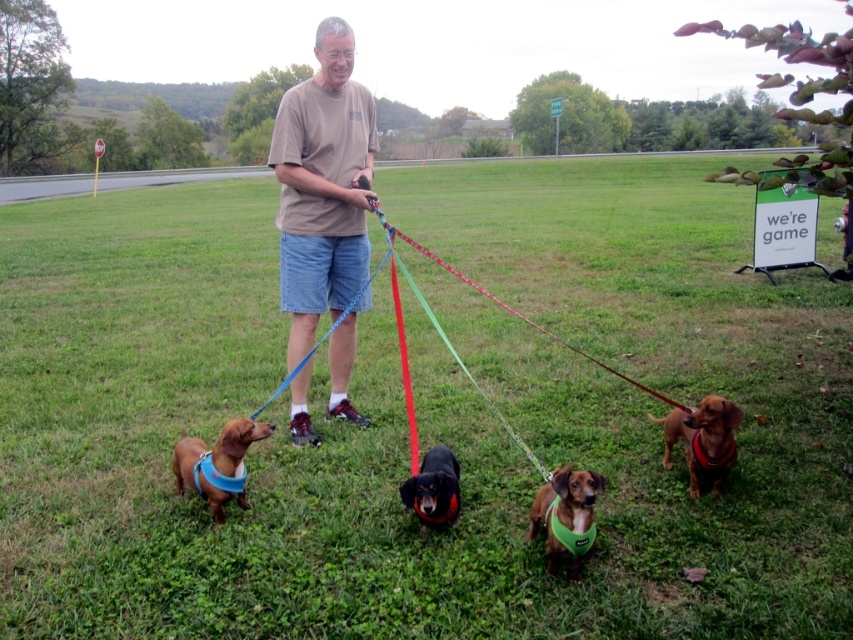
You are a photographer trying to capture a photo of the brown fabric dog at lower right and the red nylon leash at center. Based on their positions, which object should you focus on first to ensure both are in frame?

The brown fabric dog at lower right is located below the red nylon leash at center, so you should focus on the red nylon leash at center first to ensure both are in frame.